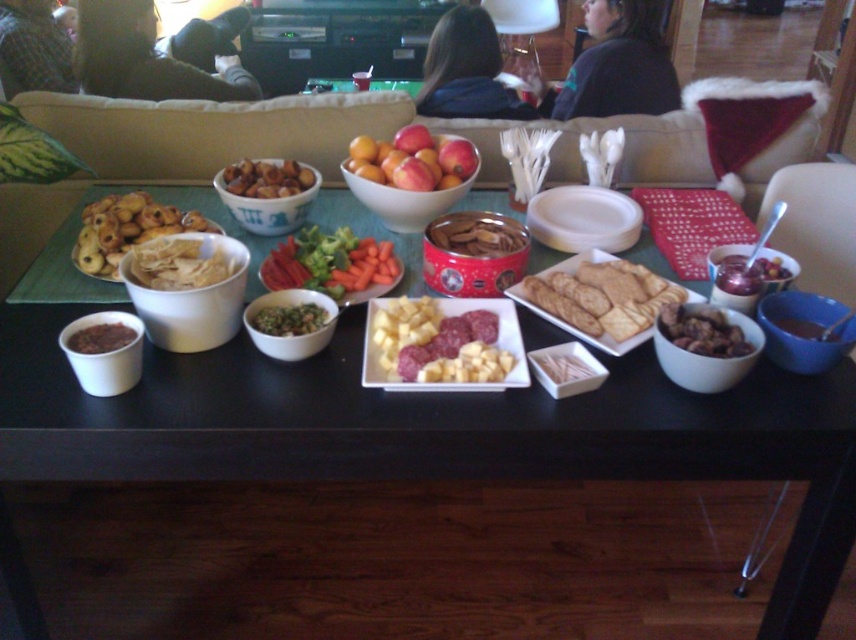
Does black plastic table at center appear under brown matte cookies at center?

Yes.

Does black plastic table at center have a greater height compared to brown matte cookies at center?

Indeed, black plastic table at center has a greater height compared to brown matte cookies at center.

This screenshot has width=856, height=640. I want to click on black plastic table at center, so click(x=434, y=433).

How far apart are green leafy vegetables at center and brown matte nuts at center?

green leafy vegetables at center and brown matte nuts at center are 7.10 inches apart from each other.

Which is behind, point (361, 257) or point (254, 163)?

The point (254, 163) is behind.

You are a GUI agent. You are given a task and a screenshot of the screen. Output one action in this format:
    pyautogui.click(x=<x>, y=<y>)
    Task: Click on the green leafy vegetables at center
    
    Given the screenshot: What is the action you would take?
    pyautogui.click(x=330, y=262)

Is the position of shiny red apples at center less distant than that of brown matte nuts at center?

Yes.

Looking at this image, is shiny red apples at center bigger than brown matte nuts at center?

Yes, shiny red apples at center is bigger than brown matte nuts at center.

Where is `shiny red apples at center`? shiny red apples at center is located at coordinates (413, 160).